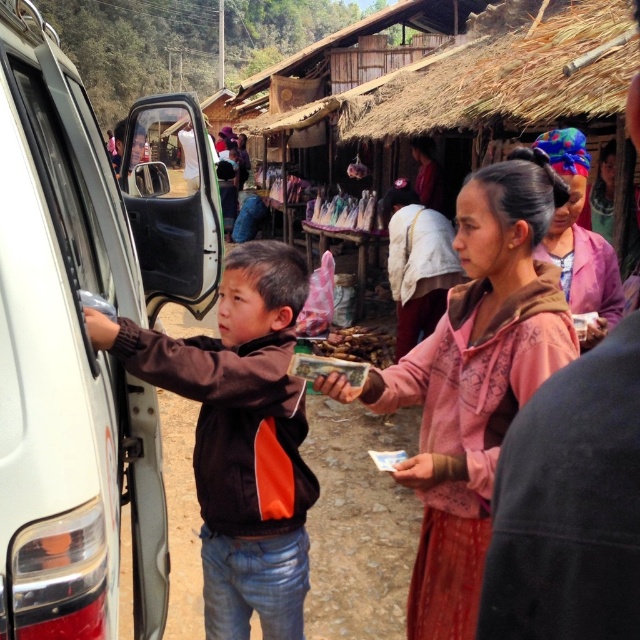
Question: Which object appears farthest from the camera in this image?

Choices:
 (A) brown wooden sticks at center
 (B) white matte van at left

Answer: (A)

Question: Based on their relative distances, which object is nearer to the brown fabric jacket at left?

Choices:
 (A) pink fabric at center
 (B) pink cotton hoodie at center
 (C) white matte van at left

Answer: (C)

Question: Does white matte van at left have a larger size compared to pink fabric at center?

Choices:
 (A) no
 (B) yes

Answer: (B)

Question: Which object appears farthest from the camera in this image?

Choices:
 (A) brown fabric jacket at left
 (B) pink fabric at center
 (C) brown wooden sticks at center
 (D) white matte van at left

Answer: (C)

Question: Considering the relative positions of brown fabric jacket at left and brown wooden sticks at center in the image provided, where is brown fabric jacket at left located with respect to brown wooden sticks at center?

Choices:
 (A) left
 (B) right

Answer: (A)

Question: Does brown fabric jacket at left appear on the left side of brown wooden sticks at center?

Choices:
 (A) yes
 (B) no

Answer: (A)